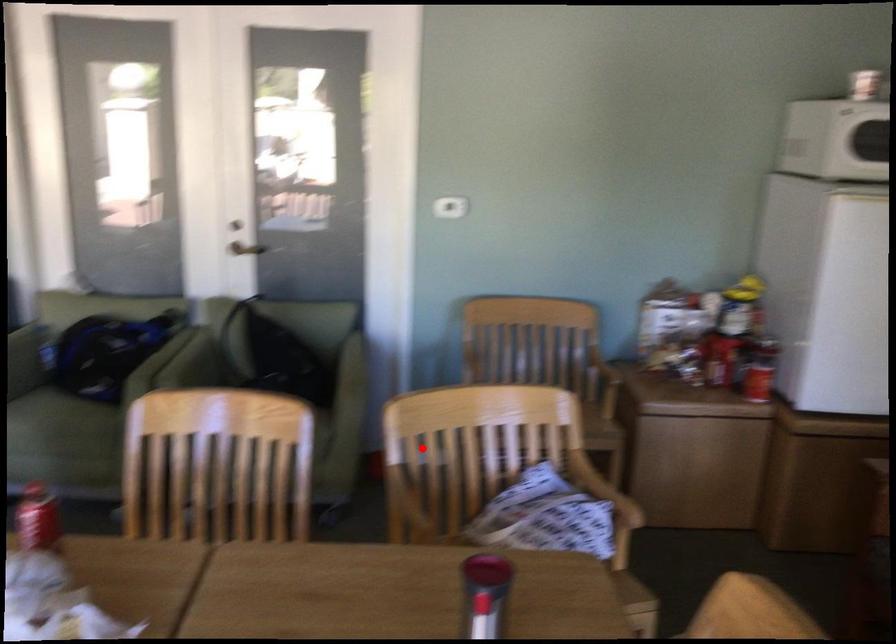
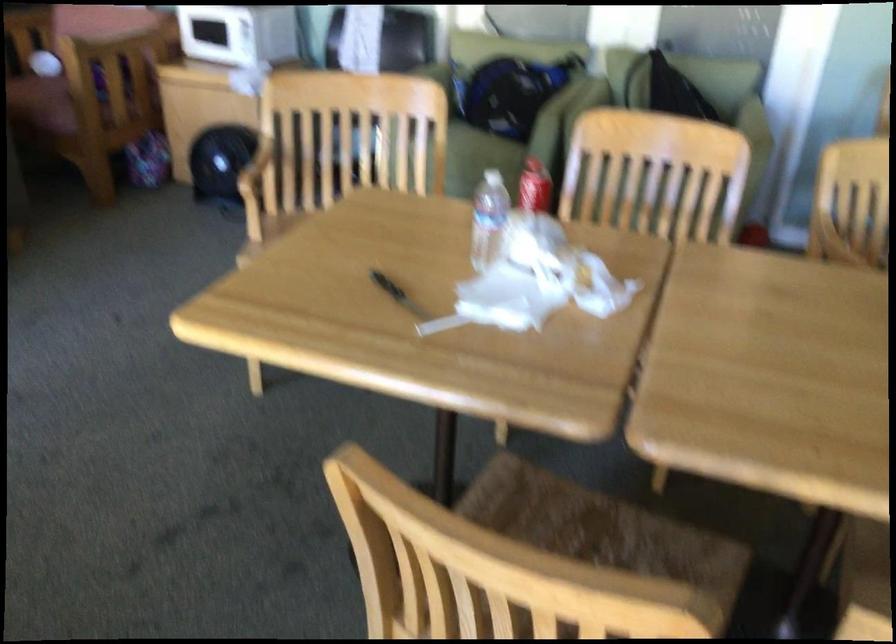
Find the pixel in the second image that matches the highlighted location in the first image.

(860, 194)